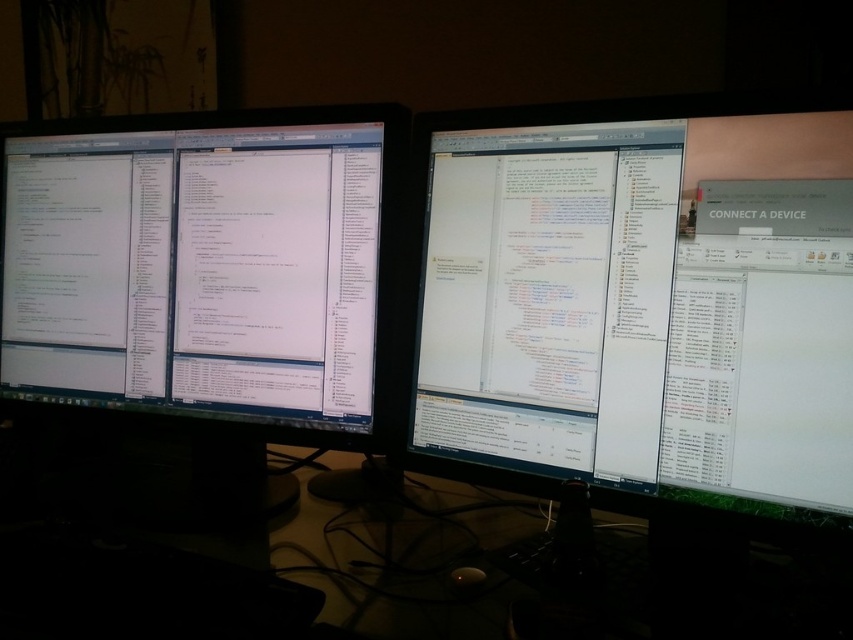
Question: Which point is farther from the camera taking this photo?

Choices:
 (A) [99, 598]
 (B) [612, 486]
 (C) [90, 225]

Answer: (C)

Question: Which point is closer to the camera?

Choices:
 (A) white glossy monitor at center
 (B) white glossy monitor at left

Answer: (A)

Question: Does white glossy monitor at left appear on the left side of white glossy monitor at center?

Choices:
 (A) no
 (B) yes

Answer: (B)

Question: Does white glossy monitor at center come in front of black glass computer desk at center?

Choices:
 (A) no
 (B) yes

Answer: (A)

Question: Can you confirm if white glossy monitor at center is positioned below black glass computer desk at center?

Choices:
 (A) yes
 (B) no

Answer: (B)

Question: Which point appears farthest from the camera in this image?

Choices:
 (A) (462, 241)
 (B) (257, 560)

Answer: (B)